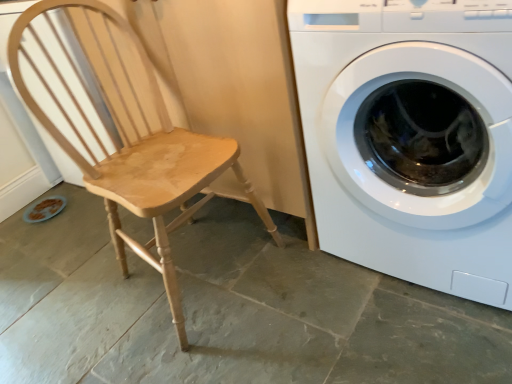
Locate an element on the screen. free space to the right of light wood chair at left is located at coordinates (321, 303).